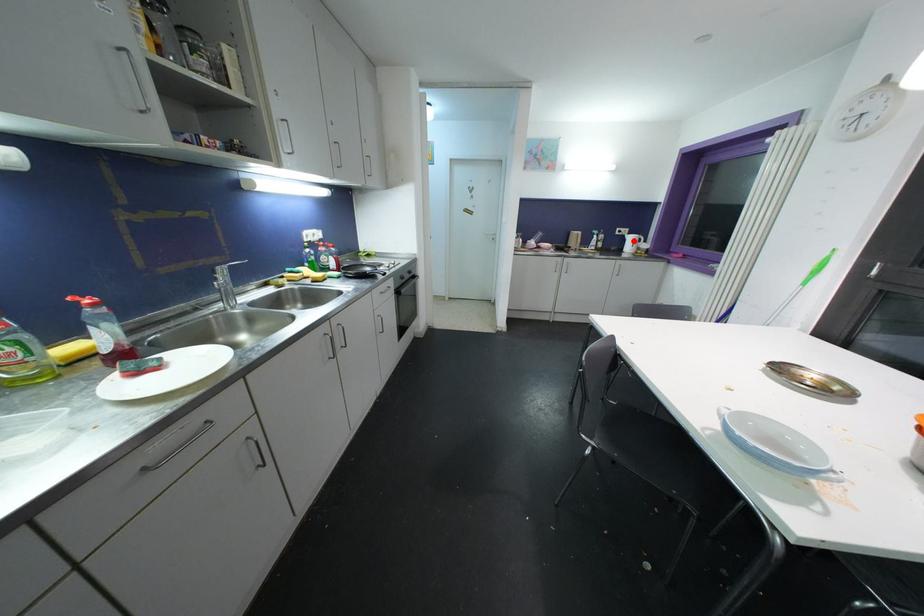
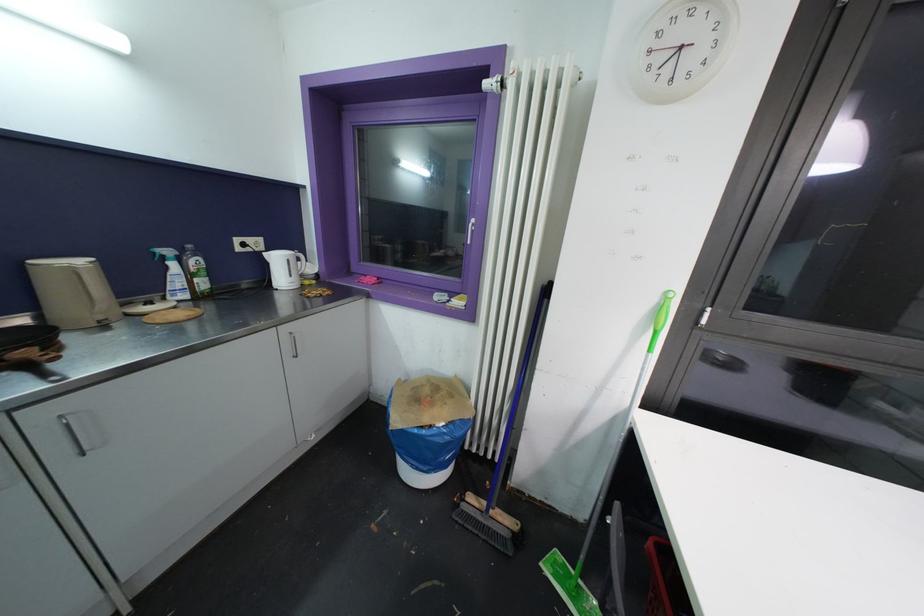
Question: I am providing you with two images of the same scene from different viewpoints. A red point is marked on the first image. Is the red point's position out of view in image 2?

Choices:
 (A) Yes
 (B) No

Answer: (B)